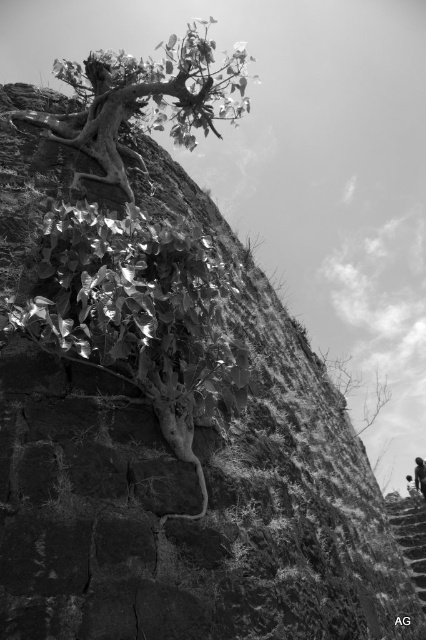
Question: Can you confirm if shiny metallic plant at center is positioned above smooth stone stairs at lower right?

Choices:
 (A) yes
 (B) no

Answer: (A)

Question: Can you confirm if shiny metallic plant at center is positioned to the right of rough bark tree at upper left?

Choices:
 (A) yes
 (B) no

Answer: (A)

Question: Among these points, which one is nearest to the camera?

Choices:
 (A) (408, 550)
 (B) (149, 61)

Answer: (B)

Question: In this image, where is rough bark tree at upper left located relative to dark skin human at lower right?

Choices:
 (A) left
 (B) right

Answer: (A)

Question: Which is nearer to the smooth stone stairs at lower right?

Choices:
 (A) shiny metallic plant at center
 (B) dark skin human at lower right

Answer: (B)

Question: Among these objects, which one is nearest to the camera?

Choices:
 (A) smooth stone stairs at lower right
 (B) rough bark tree at upper left

Answer: (B)